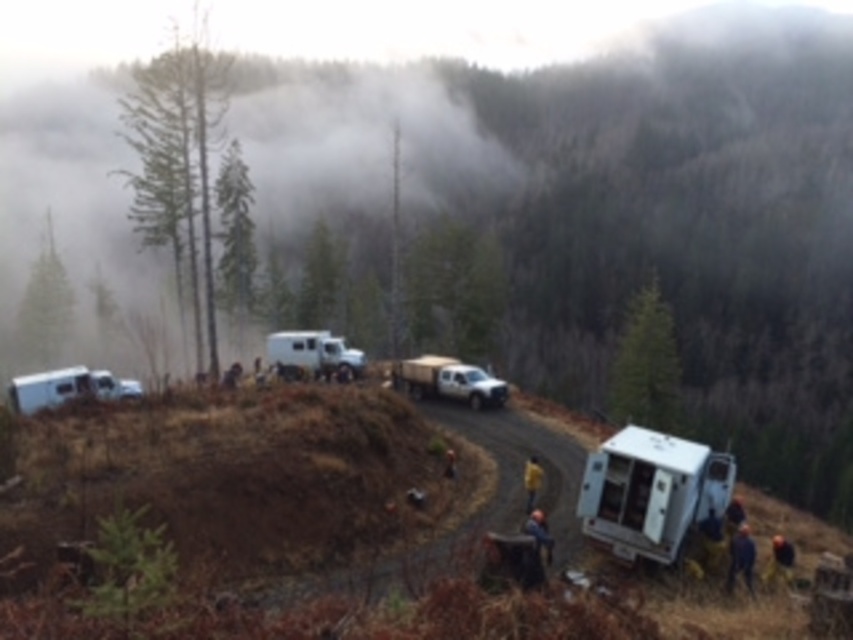
Question: Which point is farther from the camera taking this photo?

Choices:
 (A) (335, 480)
 (B) (740, 524)
 (C) (445, 456)
 (D) (457, 371)

Answer: (D)

Question: Is white matte truck at center smaller than hard hat helmet at lower right?

Choices:
 (A) yes
 (B) no

Answer: (B)

Question: Is white matte camper van at center closer to camera compared to white matte recreational vehicle at center?

Choices:
 (A) no
 (B) yes

Answer: (B)

Question: Considering the real-world distances, which object is closest to the dark blue fabric at lower right?

Choices:
 (A) yellow fabric at center
 (B) white matte recreational vehicle at center
 (C) hard hat helmet at lower right

Answer: (C)

Question: Is white matte recreational vehicle at center smaller than dark blue fabric at lower right?

Choices:
 (A) no
 (B) yes

Answer: (A)

Question: Which of the following is the farthest from the observer?

Choices:
 (A) (126, 381)
 (B) (286, 406)
 (C) (619, 529)
 (D) (445, 476)

Answer: (A)